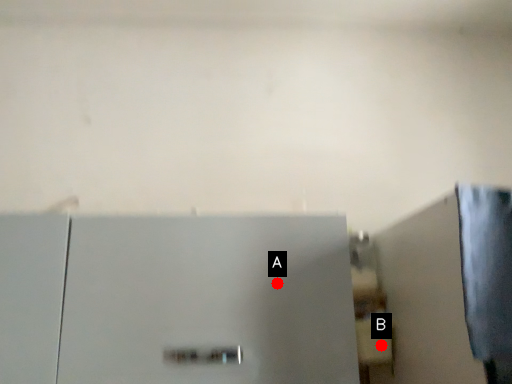
Question: Two points are circled on the image, labeled by A and B beside each circle. Which point is further to the camera?

Choices:
 (A) A is further
 (B) B is further

Answer: (B)